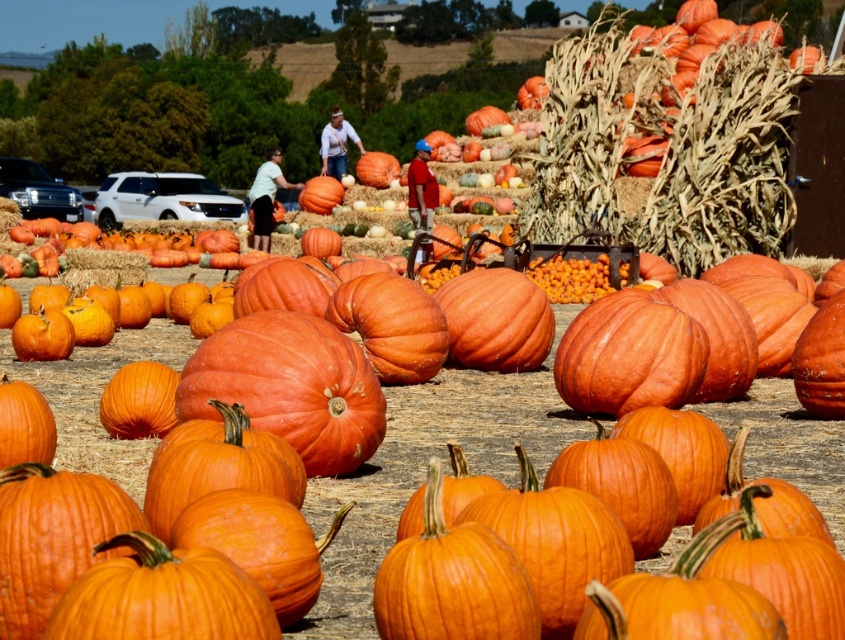
Question: Which object is farther from the camera taking this photo?

Choices:
 (A) textured straw bale at upper right
 (B) orange matte hay at lower left

Answer: (B)

Question: Which point appears farthest from the camera in this image?

Choices:
 (A) (14, 202)
 (B) (172, 625)
 (C) (129, 266)
 (D) (555, 72)

Answer: (A)

Question: Can you confirm if straw bale at center is positioned below orange matte hay at lower left?

Choices:
 (A) yes
 (B) no

Answer: (A)

Question: Which point appears closest to the camera in this image?

Choices:
 (A) (691, 240)
 (B) (3, 216)
 (C) (244, 602)
 (D) (101, 262)

Answer: (C)

Question: Can you confirm if textured straw bale at upper right is smaller than orange matte pumpkin at center?

Choices:
 (A) yes
 (B) no

Answer: (B)

Question: Does textured straw bale at upper right have a smaller size compared to orange matte hay at lower left?

Choices:
 (A) no
 (B) yes

Answer: (A)